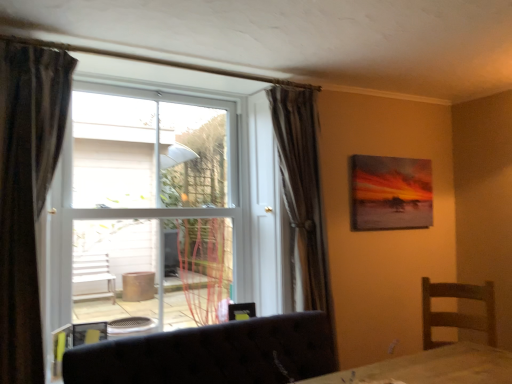
You are a GUI agent. You are given a task and a screenshot of the screen. Output one action in this format:
    pyautogui.click(x=<x>, y=<y>)
    Task: Click on the free spot above matte canvas painting at upper right (from a real-world perspective)
    
    Given the screenshot: What is the action you would take?
    pyautogui.click(x=393, y=157)